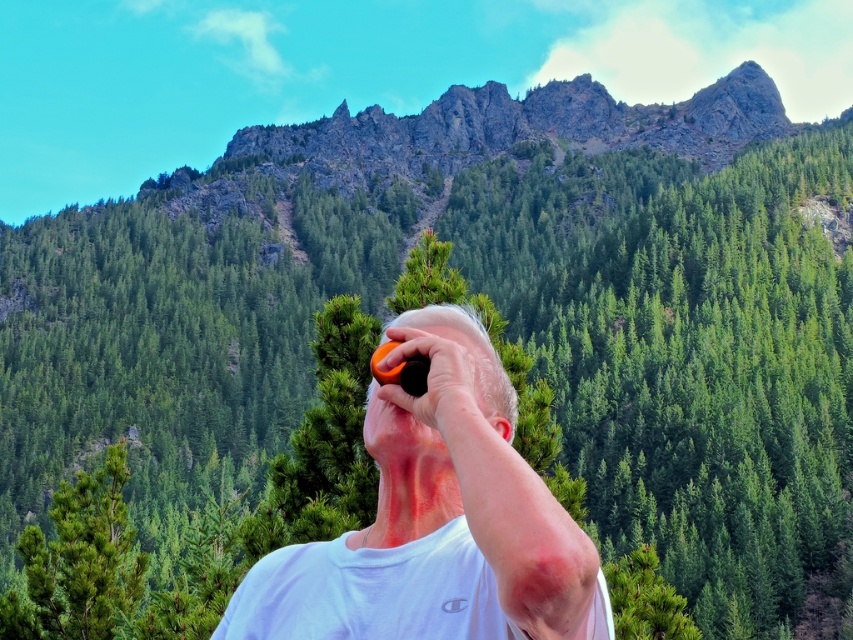
You are a photographer trying to capture the perfect shot of the two points in the scene. Which point, point (498, 385) or point (457, 403), appears closer to the camera?

Point (457, 403) appears closer to the camera because it is less further away than point (498, 385).

You are a photographer trying to capture a shot of the mountains with the orange matte camera at center and the orange matte tennis ball at upper center in the frame. Which object should you position closer to the bottom of the photo to ensure both are visible?

The orange matte camera at center should be positioned closer to the bottom of the photo because it is located below the orange matte tennis ball at upper center, so placing it lower maintains their relative positions for visibility.